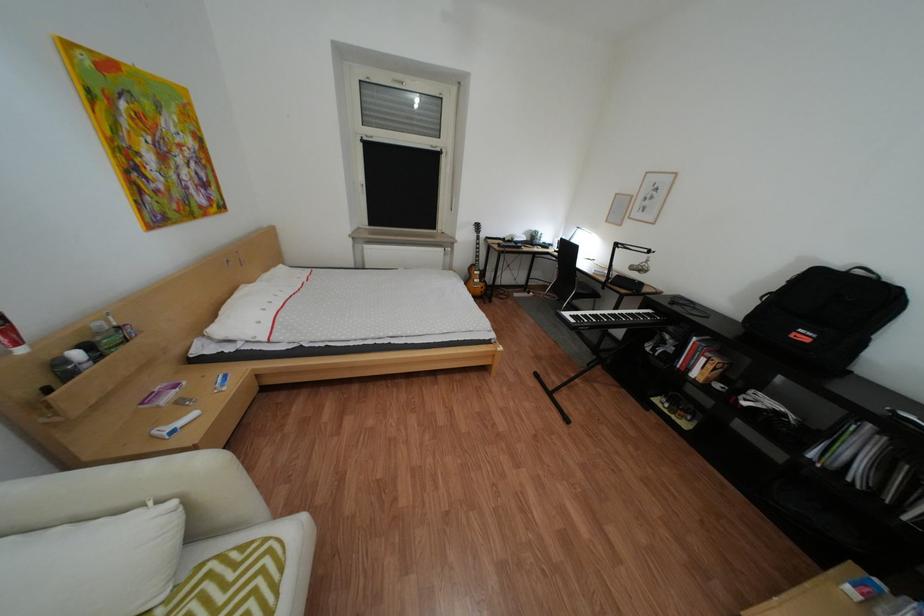
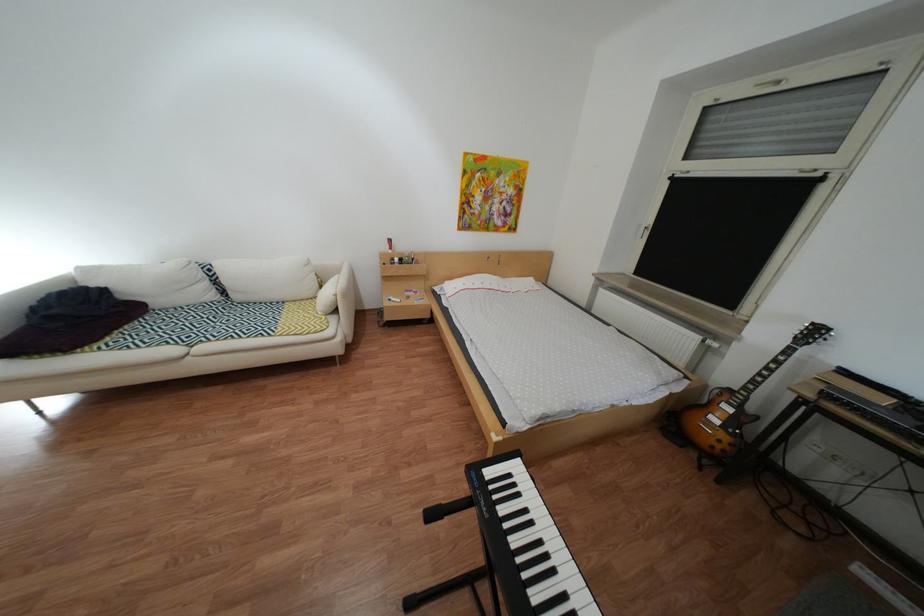
Locate, in the second image, the point that corresponds to point (488, 229) in the first image.

(810, 330)